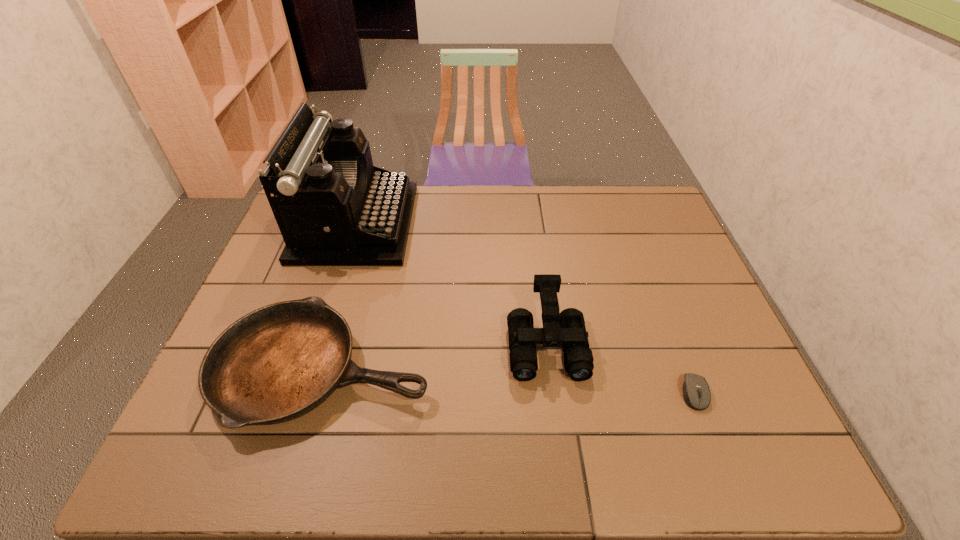
Image resolution: width=960 pixels, height=540 pixels. I want to click on vacant region located on the front of the computer equipment, so click(710, 433).

At what (x,y) coordinates should I click in order to perform the action: click on object located at the far edge. Please return your answer as a coordinate pair (x, y). The width and height of the screenshot is (960, 540). Looking at the image, I should click on (333, 207).

At what (x,y) coordinates should I click in order to perform the action: click on object at the near edge. Please return your answer as a coordinate pair (x, y). This screenshot has height=540, width=960. Looking at the image, I should click on (277, 363).

I want to click on typewriter that is at the left edge, so click(333, 207).

The image size is (960, 540). What are the coordinates of `frying pan at the left edge` in the screenshot? It's located at (277, 363).

This screenshot has height=540, width=960. In order to click on object present at the right edge in this screenshot , I will do `click(696, 392)`.

Find the location of a particular element. The height and width of the screenshot is (540, 960). object that is at the far left corner is located at coordinates (333, 207).

Identify the location of object that is at the near left corner. (277, 363).

This screenshot has width=960, height=540. Find the location of `blank space at the far edge`. blank space at the far edge is located at coordinates (566, 193).

In the image, there is a desktop. At what (x,y) coordinates should I click in order to perform the action: click on vacant space at the near edge. Please return your answer as a coordinate pair (x, y). The image size is (960, 540). Looking at the image, I should click on (403, 468).